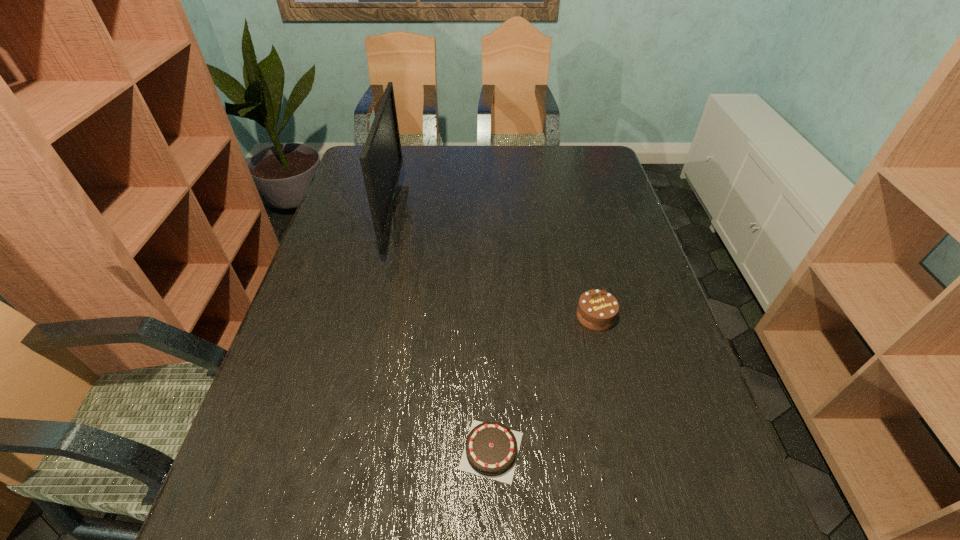
Locate an element on the screen. The image size is (960, 540). blank space that satisfies the following two spatial constraints: 1. on the front-facing side of the farther chocolate cake; 2. on the right side of the monitor is located at coordinates (373, 316).

This screenshot has height=540, width=960. I want to click on vacant space that satisfies the following two spatial constraints: 1. on the back side of the rightmost object; 2. on the front-facing side of the leftmost object, so click(572, 217).

Where is `vacant space that satisfies the following two spatial constraints: 1. on the back side of the shortest object; 2. on the front-facing side of the farthest object`? The width and height of the screenshot is (960, 540). vacant space that satisfies the following two spatial constraints: 1. on the back side of the shortest object; 2. on the front-facing side of the farthest object is located at coordinates (487, 217).

Identify the location of free space that satisfies the following two spatial constraints: 1. on the front-facing side of the tallest object; 2. on the right side of the right chocolate cake. The image size is (960, 540). (373, 316).

Where is `free space that satisfies the following two spatial constraints: 1. on the front-facing side of the tallest object; 2. on the right side of the shortest object`? The height and width of the screenshot is (540, 960). free space that satisfies the following two spatial constraints: 1. on the front-facing side of the tallest object; 2. on the right side of the shortest object is located at coordinates click(x=344, y=450).

Identify the location of vacant space that satisfies the following two spatial constraints: 1. on the front-facing side of the taller chocolate cake; 2. on the left side of the leftmost object. The height and width of the screenshot is (540, 960). (373, 316).

At what (x,y) coordinates should I click in order to perform the action: click on vacant point that satisfies the following two spatial constraints: 1. on the front-facing side of the farthest object; 2. on the left side of the second object from left to right. Please return your answer as a coordinate pair (x, y). Looking at the image, I should click on (344, 450).